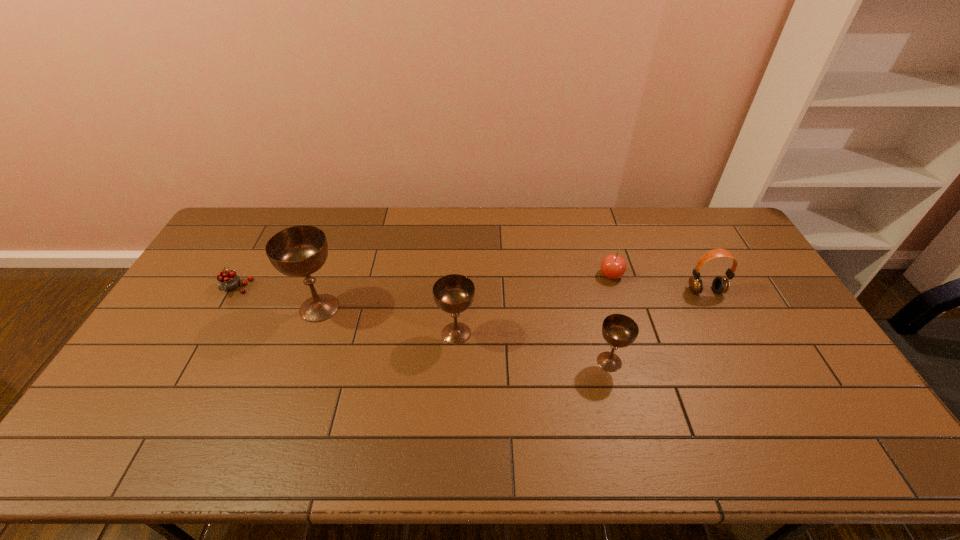
Image resolution: width=960 pixels, height=540 pixels. Identify the location of free space between the fifth object from right to left and the leftmost object. (277, 298).

What are the coordinates of `free spot between the second object from left to right and the leftmost object` in the screenshot? It's located at (277, 298).

You are a GUI agent. You are given a task and a screenshot of the screen. Output one action in this format:
    pyautogui.click(x=<x>, y=<y>)
    Task: Click on the free space between the cherry and the leftmost chalice
    Image resolution: width=960 pixels, height=540 pixels.
    Given the screenshot: What is the action you would take?
    277,298

This screenshot has width=960, height=540. Find the location of `free point between the leftmost chalice and the leftmost object`. free point between the leftmost chalice and the leftmost object is located at coordinates (277, 298).

Where is `vacant area that lies between the tallest chalice and the cherry`? vacant area that lies between the tallest chalice and the cherry is located at coordinates (277, 298).

The width and height of the screenshot is (960, 540). I want to click on free space between the second tallest chalice and the apple, so click(x=534, y=304).

Where is `free space between the shortest chalice and the headset`? The image size is (960, 540). free space between the shortest chalice and the headset is located at coordinates point(658,326).

Identify the location of empty location between the apple and the cherry. The height and width of the screenshot is (540, 960). (423, 281).

Choose which object is the fourth nearest neighbor to the fifth shortest object. Please provide its 2D coordinates. Your answer should be formatted as a tuple, i.e. [(x, y)], where the tuple contains the x and y coordinates of a point satisfying the conditions above.

[(228, 280)]

Find the location of a particular element. Image resolution: width=960 pixels, height=540 pixels. object that is the third closest one to the leftmost chalice is located at coordinates (618, 330).